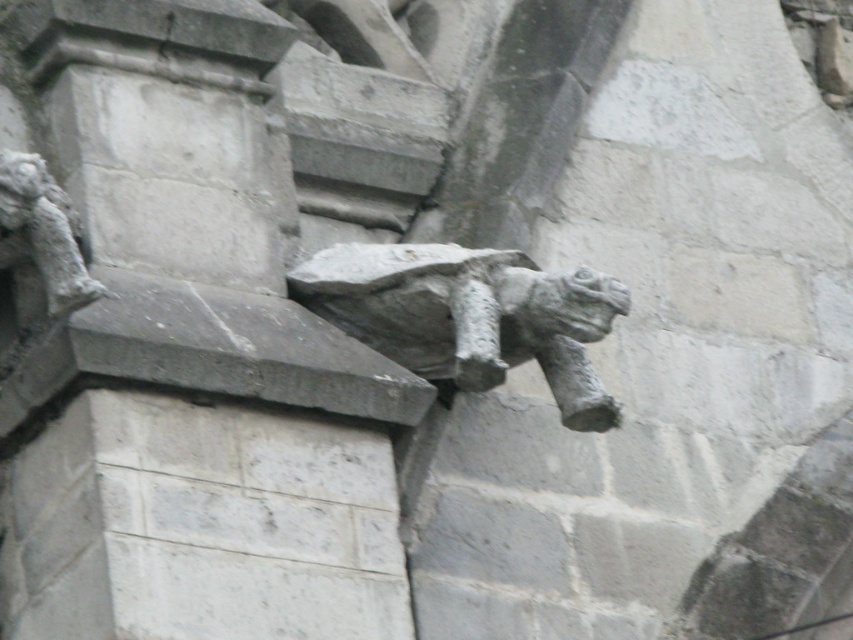
Question: Which point appears closest to the camera in this image?

Choices:
 (A) (479, 340)
 (B) (13, 161)

Answer: (B)

Question: Does gray stone gargoyle at upper center come in front of gray stone gargoyle at upper left?

Choices:
 (A) yes
 (B) no

Answer: (B)

Question: Which of the following is the farthest from the observer?

Choices:
 (A) (344, 250)
 (B) (85, 289)

Answer: (A)

Question: Does gray stone gargoyle at upper center lie in front of gray stone gargoyle at upper left?

Choices:
 (A) yes
 (B) no

Answer: (B)

Question: Is gray stone gargoyle at upper center wider than gray stone gargoyle at upper left?

Choices:
 (A) yes
 (B) no

Answer: (B)